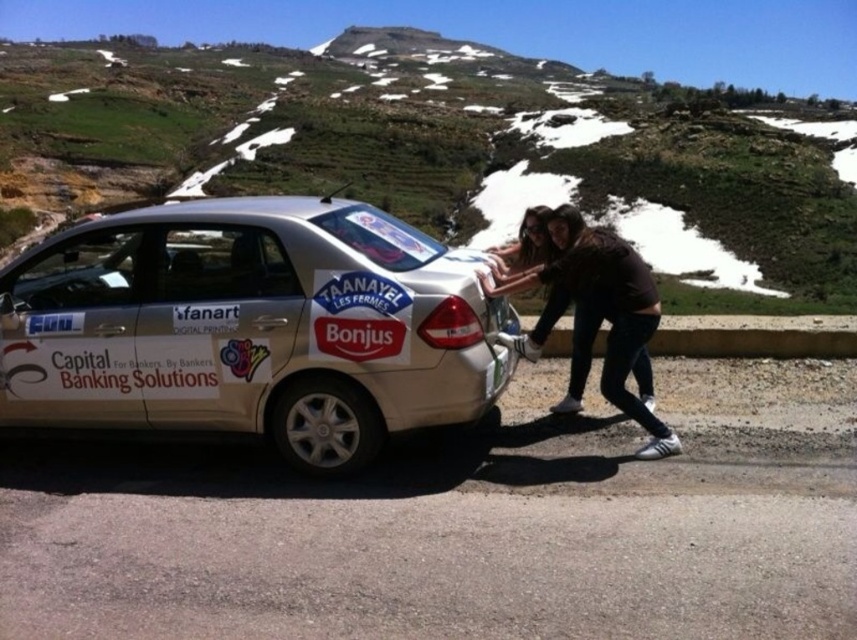
You are standing at the roadside and see the gold metallic car at center and the dark brown leather jacket at center. Which object is positioned more to the left?

The gold metallic car at center is positioned to the left of the dark brown leather jacket at center.

You are a pedestrian standing on the roadside. You see the gold metallic car at center and the dark brown leather jacket at center. Which object is higher in position?

The gold metallic car at center is higher in position than the dark brown leather jacket at center.